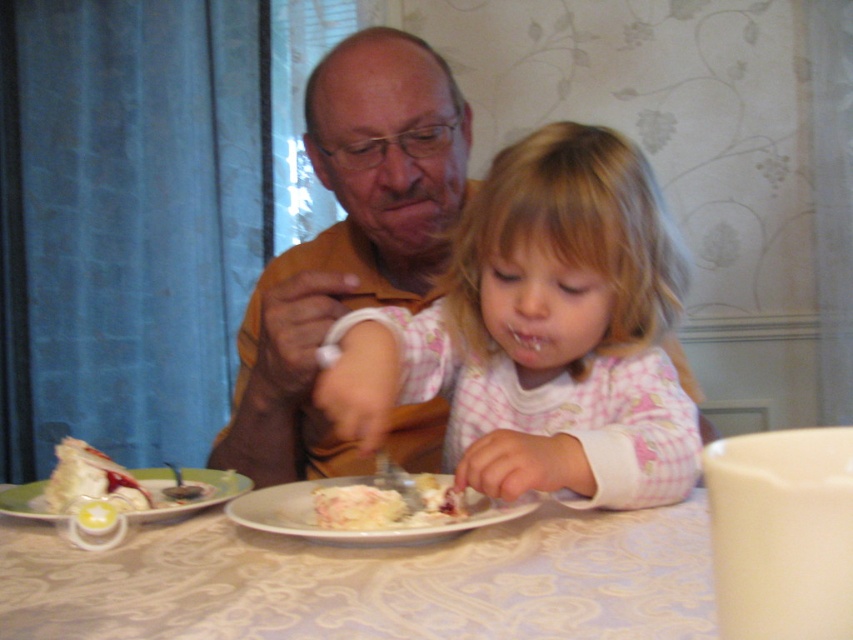
Question: Which object is farther from the camera taking this photo?

Choices:
 (A) white ceramic plate at lower left
 (B) white matte plate at center
 (C) pink checkered pajamas at center

Answer: (A)

Question: Is pink checkered pajamas at center to the right of white creamy cake at lower left from the viewer's perspective?

Choices:
 (A) yes
 (B) no

Answer: (A)

Question: Which object appears farthest from the camera in this image?

Choices:
 (A) white matte plate at center
 (B) white creamy cake at lower left
 (C) brown shirt at center

Answer: (C)

Question: In this image, where is brown shirt at center located relative to white creamy cake at lower left?

Choices:
 (A) left
 (B) right

Answer: (B)

Question: Can you confirm if white lace tablecloth at center is positioned to the right of white creamy cake at lower left?

Choices:
 (A) yes
 (B) no

Answer: (A)

Question: Which of these objects is positioned closest to the white creamy cake at center?

Choices:
 (A) white ceramic plate at lower left
 (B) white creamy cake at lower left
 (C) brown shirt at center

Answer: (A)